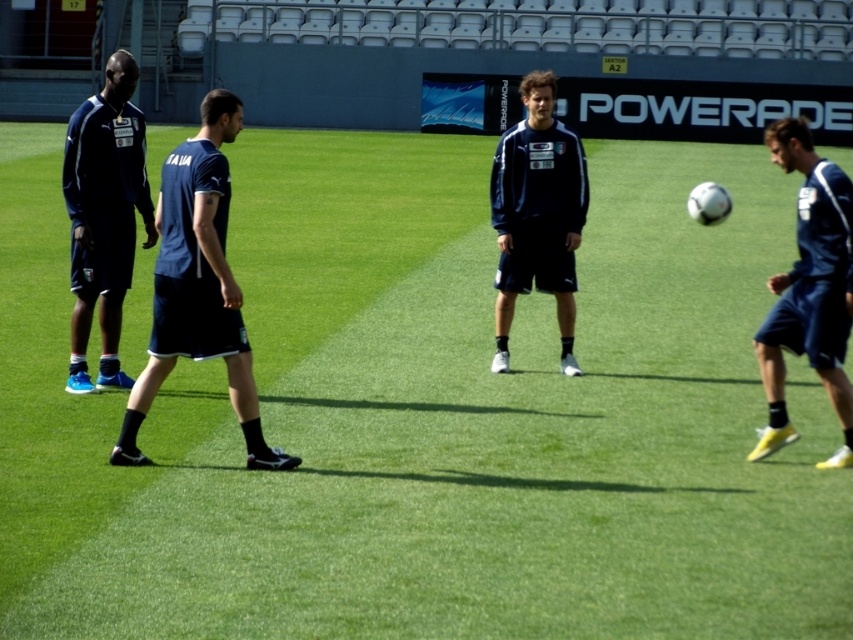
Can you confirm if matte blue shorts at left is positioned to the right of dark blue jersey at center?

In fact, matte blue shorts at left is to the left of dark blue jersey at center.

Between matte blue shorts at left and dark blue jersey at center, which one appears on the right side from the viewer's perspective?

From the viewer's perspective, dark blue jersey at center appears more on the right side.

This screenshot has width=853, height=640. Find the location of `matte blue shorts at left`. matte blue shorts at left is located at coordinates (103, 216).

The height and width of the screenshot is (640, 853). What are the coordinates of `matte blue shorts at left` in the screenshot? It's located at (103, 216).

Who is positioned more to the left, dark blue shorts at right or dark blue jersey at center?

Positioned to the left is dark blue jersey at center.

Who is positioned more to the right, dark blue shorts at right or dark blue jersey at center?

From the viewer's perspective, dark blue shorts at right appears more on the right side.

At what (x,y) coordinates should I click in order to perform the action: click on dark blue shorts at right. Please return your answer as a coordinate pair (x, y). The height and width of the screenshot is (640, 853). Looking at the image, I should click on (809, 291).

Does dark blue fabric shorts at center have a lesser width compared to matte blue shorts at left?

Incorrect, dark blue fabric shorts at center's width is not less than matte blue shorts at left's.

Does dark blue fabric shorts at center appear under matte blue shorts at left?

Yes, dark blue fabric shorts at center is below matte blue shorts at left.

Is point (184, 284) closer to viewer compared to point (123, 208)?

Yes.

Identify the location of dark blue fabric shorts at center. The image size is (853, 640). (198, 284).